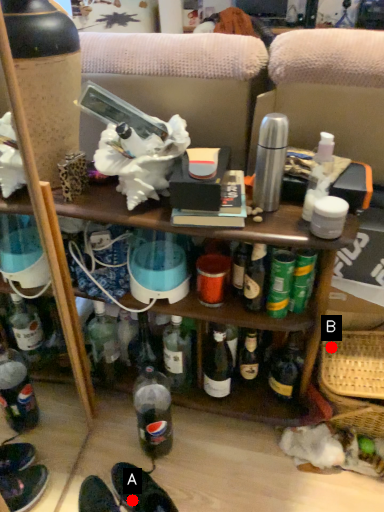
Question: Two points are circled on the image, labeled by A and B beside each circle. Which point appears closest to the camera in this image?

Choices:
 (A) A is closer
 (B) B is closer

Answer: (A)